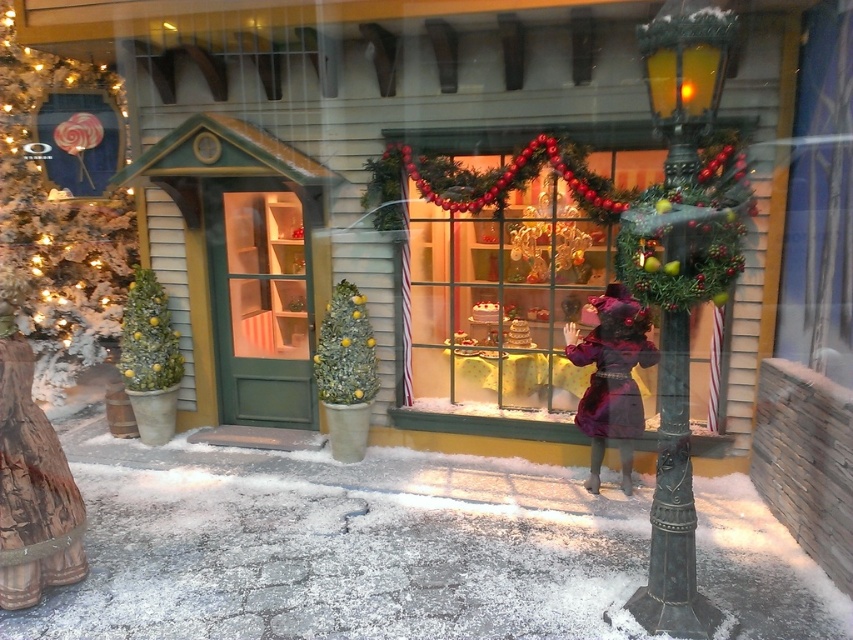
Locate an element on the screen. This screenshot has width=853, height=640. green metal lamp post at right is located at coordinates (672, 504).

Does point (689, 70) lie in front of point (614, 346)?

That is True.

Locate an element on the screen. Image resolution: width=853 pixels, height=640 pixels. green metal lamp post at right is located at coordinates [x=672, y=504].

Does velvet purple coat at center have a smaller size compared to green matte christmas tree at left?

No.

Consider the image. Can you confirm if velvet purple coat at center is positioned to the right of green matte christmas tree at left?

Indeed, velvet purple coat at center is positioned on the right side of green matte christmas tree at left.

Does point (599, 445) come closer to viewer compared to point (126, 342)?

Yes, it is.

At what (x,y) coordinates should I click in order to perform the action: click on velvet purple coat at center. Please return your answer as a coordinate pair (x, y). Looking at the image, I should click on (611, 378).

Who is positioned more to the left, green metal lamp post at right or green matte christmas tree at left?

From the viewer's perspective, green matte christmas tree at left appears more on the left side.

Describe the element at coordinates (672, 504) in the screenshot. I see `green metal lamp post at right` at that location.

The height and width of the screenshot is (640, 853). I want to click on green metal lamp post at right, so click(x=672, y=504).